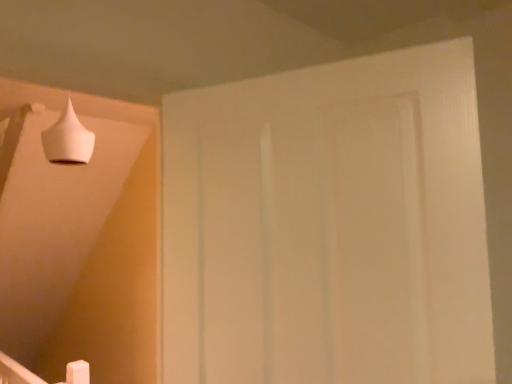
Find the location of `white matte door at center`. white matte door at center is located at coordinates (328, 226).

What do you see at coordinates (328, 226) in the screenshot? I see `white matte door at center` at bounding box center [328, 226].

What do you see at coordinates (68, 139) in the screenshot?
I see `white matte cone at upper left` at bounding box center [68, 139].

What is the approximate width of white matte cone at upper left?

The width of white matte cone at upper left is 19.20 centimeters.

Find the location of a particular element. The width and height of the screenshot is (512, 384). white matte cone at upper left is located at coordinates (68, 139).

Locate an element on the screen. This screenshot has height=384, width=512. white matte door at center is located at coordinates (328, 226).

Does white matte door at center appear on the right side of white matte cone at upper left?

Indeed, white matte door at center is positioned on the right side of white matte cone at upper left.

Considering the positions of objects white matte door at center and white matte cone at upper left in the image provided, who is in front, white matte door at center or white matte cone at upper left?

white matte door at center.

Based on the photo, which is closer, (393, 235) or (60, 125)?

The point (393, 235) is closer.

From the image's perspective, between white matte door at center and white matte cone at upper left, which one is located above?

From the image's view, white matte cone at upper left is above.

From a real-world perspective, is white matte door at center physically above white matte cone at upper left?

Incorrect, from a real-world perspective, white matte door at center is lower than white matte cone at upper left.

Which of these two, white matte door at center or white matte cone at upper left, is wider?

white matte cone at upper left.

From their relative heights in the image, would you say white matte door at center is taller or shorter than white matte cone at upper left?

Considering their sizes, white matte door at center has more height than white matte cone at upper left.

Is white matte door at center smaller than white matte cone at upper left?

Actually, white matte door at center might be larger than white matte cone at upper left.

Based on the photo, could white matte cone at upper left be considered to be inside white matte door at center?

No, white matte cone at upper left is not a part of white matte door at center.

Would you consider white matte door at center to be distant from white matte cone at upper left?

Absolutely, white matte door at center is distant from white matte cone at upper left.

Could you tell me if white matte door at center is turned towards white matte cone at upper left?

No, white matte door at center is not aimed at white matte cone at upper left.

How far apart are white matte door at center and white matte cone at upper left?

white matte door at center is 1.35 meters away from white matte cone at upper left.

I want to click on lamp above the white matte door at center (from a real-world perspective), so click(x=68, y=139).

Based on their positions, is white matte cone at upper left located to the left or right of white matte door at center?

Clearly, white matte cone at upper left is on the left of white matte door at center in the image.

From the picture: Does white matte cone at upper left come behind white matte door at center?

Yes, white matte cone at upper left is further from the camera.

Is point (63, 111) farther from camera compared to point (283, 191)?

Yes, point (63, 111) is behind point (283, 191).

From the image's perspective, between white matte cone at upper left and white matte door at center, which one is located above?

white matte cone at upper left.

From a real-world perspective, which is physically above, white matte cone at upper left or white matte door at center?

white matte cone at upper left, from a real-world perspective.

Is white matte cone at upper left thinner than white matte door at center?

No.

Between white matte cone at upper left and white matte door at center, which one has more height?

Standing taller between the two is white matte door at center.

Which of these two, white matte cone at upper left or white matte door at center, is smaller?

Smaller between the two is white matte cone at upper left.

Is white matte cone at upper left outside of white matte door at center?

Indeed, white matte cone at upper left is completely outside white matte door at center.

In the scene shown: Is white matte cone at upper left touching white matte door at center?

white matte cone at upper left and white matte door at center are clearly separated.

Is white matte cone at upper left facing away from white matte door at center?

Yes.

How different are the orientations of white matte cone at upper left and white matte door at center in degrees?

white matte cone at upper left and white matte door at center are facing 109 degrees away from each other.

How distant is white matte cone at upper left from white matte door at center?

A distance of 1.35 meters exists between white matte cone at upper left and white matte door at center.

The image size is (512, 384). I want to click on lamp on the left of white matte door at center, so click(68, 139).

Locate an element on the screen. The width and height of the screenshot is (512, 384). door that is in front of the white matte cone at upper left is located at coordinates (328, 226).

In order to click on door that is under the white matte cone at upper left (from a real-world perspective) in this screenshot , I will do tap(328, 226).